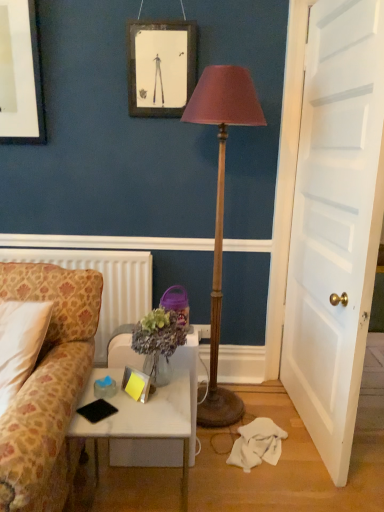
Where is `free spot above white textured radiator at left (from a real-world perspective)`? The width and height of the screenshot is (384, 512). free spot above white textured radiator at left (from a real-world perspective) is located at coordinates (81, 249).